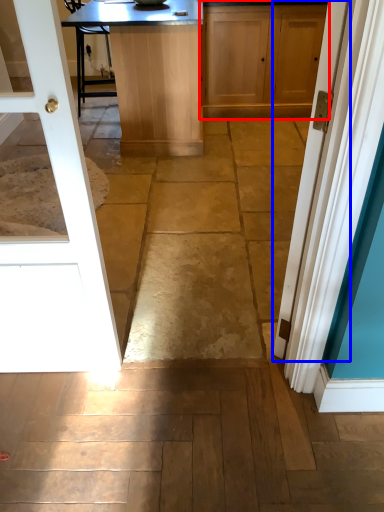
Question: Which of the following is the closest to the observer, cabinetry (highlighted by a red box) or door (highlighted by a blue box)?

Choices:
 (A) cabinetry
 (B) door

Answer: (B)